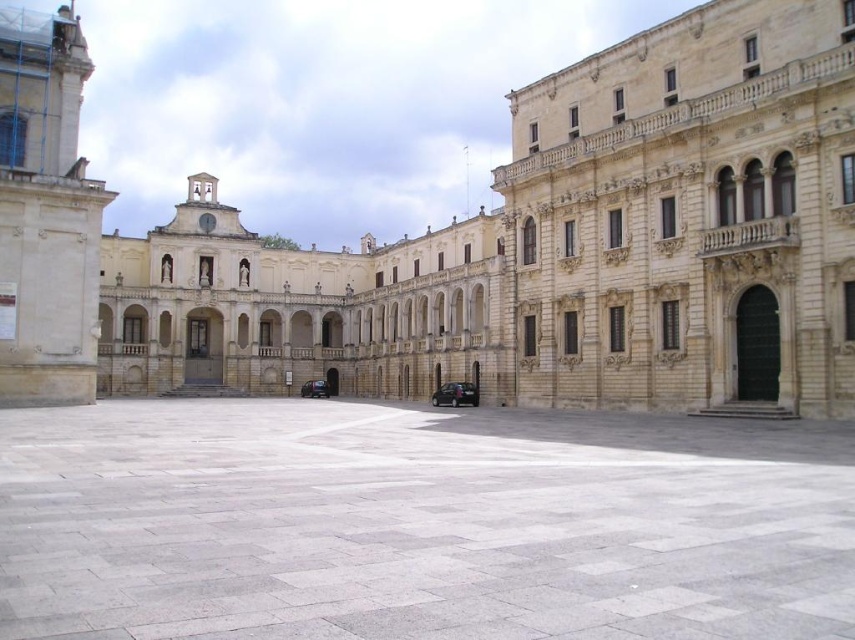
In the scene shown: Which is more to the left, gray stone courtyard at center or shiny dark blue car at center?

Positioned to the left is shiny dark blue car at center.

Who is more distant from viewer, (388, 476) or (317, 396)?

The point (317, 396) is behind.

Where is `gray stone courtyard at center`? This screenshot has width=855, height=640. gray stone courtyard at center is located at coordinates (417, 524).

Looking at this image, between gray stone courtyard at center and shiny black car at center, which one is positioned higher?

gray stone courtyard at center is higher up.

Is gray stone courtyard at center taller than shiny black car at center?

No.

Is point (502, 524) positioned after point (433, 394)?

No, (502, 524) is in front of (433, 394).

Locate an element on the screen. The width and height of the screenshot is (855, 640). gray stone courtyard at center is located at coordinates (417, 524).

Does beige stone palace at center appear on the right side of gray stone courtyard at center?

No, beige stone palace at center is not to the right of gray stone courtyard at center.

Is the position of beige stone palace at center less distant than that of gray stone courtyard at center?

No, it is not.

You are a GUI agent. You are given a task and a screenshot of the screen. Output one action in this format:
    pyautogui.click(x=<x>, y=<y>)
    Task: Click on the beige stone palace at center
    
    Given the screenshot: What is the action you would take?
    pyautogui.click(x=479, y=243)

Locate an element on the screen. The height and width of the screenshot is (640, 855). beige stone palace at center is located at coordinates (479, 243).